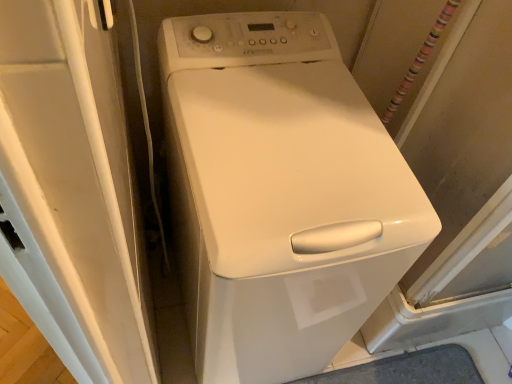
Question: Should I look upward or downward to see white glossy washing machine at center?

Choices:
 (A) up
 (B) down

Answer: (B)